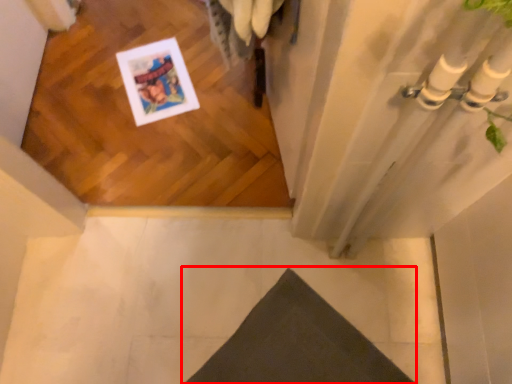
Question: From the image's perspective, where is doormat (annotated by the red box) located relative to concrete?

Choices:
 (A) above
 (B) below

Answer: (B)